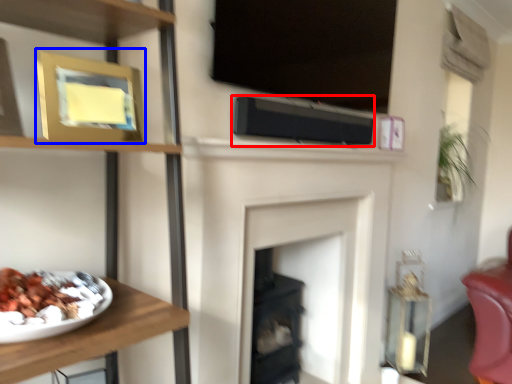
Question: Which object appears farthest to the camera in this image, speaker (highlighted by a red box) or picture frame (highlighted by a blue box)?

Choices:
 (A) speaker
 (B) picture frame

Answer: (A)